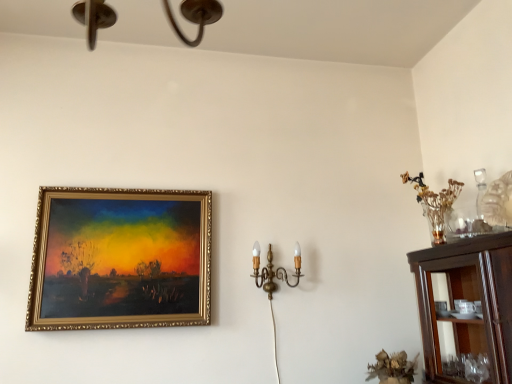
Where is `dark wood cabinet at right`? dark wood cabinet at right is located at coordinates (469, 300).

In order to click on gold ornate frame at upper left in this screenshot , I will do 120,259.

Image resolution: width=512 pixels, height=384 pixels. What are the coordinates of `dark wood cabinet at right` in the screenshot? It's located at (469, 300).

Would you say gold ornate frame at upper left is outside gold brass wall sconce at center right?

Yes, gold ornate frame at upper left is located beyond the bounds of gold brass wall sconce at center right.

Could you tell me if gold ornate frame at upper left is turned towards gold brass wall sconce at center right?

No, gold ornate frame at upper left is not oriented towards gold brass wall sconce at center right.

Considering the relative sizes of gold ornate frame at upper left and gold brass wall sconce at center right in the image provided, is gold ornate frame at upper left wider than gold brass wall sconce at center right?

Incorrect, the width of gold ornate frame at upper left does not surpass that of gold brass wall sconce at center right.

From a real-world perspective, does dark wood cabinet at right sit lower than gold brass wall sconce at center right?

Indeed, from a real-world perspective, dark wood cabinet at right is positioned beneath gold brass wall sconce at center right.

Is dark wood cabinet at right bigger or smaller than gold brass wall sconce at center right?

Considering their sizes, dark wood cabinet at right takes up more space than gold brass wall sconce at center right.

Is dark wood cabinet at right wider than gold brass wall sconce at center right?

Yes.

Is dark wood cabinet at right to the left of gold brass wall sconce at center right from the viewer's perspective?

In fact, dark wood cabinet at right is to the right of gold brass wall sconce at center right.

Locate an element on the screen. This screenshot has height=384, width=512. cabinetry in front of the gold brass wall sconce at center right is located at coordinates (469, 300).

Can you tell me how much gold brass wall sconce at center right and dark wood cabinet at right differ in facing direction?

89.1 degrees separate the facing orientations of gold brass wall sconce at center right and dark wood cabinet at right.

From the picture: From the image's perspective, which is below, gold brass wall sconce at center right or dark wood cabinet at right?

From the image's view, dark wood cabinet at right is below.

Looking at their sizes, would you say gold brass wall sconce at center right is wider or thinner than dark wood cabinet at right?

gold brass wall sconce at center right is thinner than dark wood cabinet at right.

Can we say dark wood cabinet at right lies outside gold ornate frame at upper left?

Yes, dark wood cabinet at right is outside of gold ornate frame at upper left.

Which is more to the right, dark wood cabinet at right or gold ornate frame at upper left?

From the viewer's perspective, dark wood cabinet at right appears more on the right side.

Does point (433, 376) come closer to viewer compared to point (45, 291)?

Yes, point (433, 376) is closer to viewer.

Does gold ornate frame at upper left have a greater height compared to dark wood cabinet at right?

Correct, gold ornate frame at upper left is much taller as dark wood cabinet at right.

Could dark wood cabinet at right be considered to be inside gold ornate frame at upper left?

No, gold ornate frame at upper left does not contain dark wood cabinet at right.

Is gold ornate frame at upper left not close to dark wood cabinet at right?

Yes, gold ornate frame at upper left is far from dark wood cabinet at right.

This screenshot has height=384, width=512. I want to click on picture frame above the gold brass wall sconce at center right (from a real-world perspective), so click(x=120, y=259).

Can you tell me how much gold brass wall sconce at center right and gold ornate frame at upper left differ in facing direction?

The angular difference between gold brass wall sconce at center right and gold ornate frame at upper left is 0.436 degrees.

From the image's perspective, which is above, gold brass wall sconce at center right or gold ornate frame at upper left?

gold ornate frame at upper left appears higher in the image.

From a real-world perspective, is gold brass wall sconce at center right on gold ornate frame at upper left?

No.

The height and width of the screenshot is (384, 512). I want to click on picture frame positioned vertically above the gold brass wall sconce at center right (from a real-world perspective), so click(x=120, y=259).

Locate an element on the screen. cabinetry below the gold brass wall sconce at center right (from a real-world perspective) is located at coordinates (469, 300).

When comparing their distances from dark wood cabinet at right, does gold brass wall sconce at center right or gold ornate frame at upper left seem further?

Based on the image, gold ornate frame at upper left appears to be further to dark wood cabinet at right.

From the image, which object appears to be farther from gold ornate frame at upper left, gold brass wall sconce at center right or dark wood cabinet at right?

The object further to gold ornate frame at upper left is dark wood cabinet at right.

From the image, which object appears to be nearer to gold brass wall sconce at center right, dark wood cabinet at right or gold ornate frame at upper left?

gold ornate frame at upper left is positioned closer to the anchor gold brass wall sconce at center right.

Considering their positions, is dark wood cabinet at right positioned further to gold ornate frame at upper left than gold brass wall sconce at center right?

dark wood cabinet at right is positioned further to the anchor gold ornate frame at upper left.

Estimate the real-world distances between objects in this image. Which object is closer to dark wood cabinet at right, gold ornate frame at upper left or gold brass wall sconce at center right?

gold brass wall sconce at center right lies closer to dark wood cabinet at right than the other object.

Estimate the real-world distances between objects in this image. Which object is further from gold brass wall sconce at center right, gold ornate frame at upper left or dark wood cabinet at right?

dark wood cabinet at right lies further to gold brass wall sconce at center right than the other object.

At what (x,y) coordinates should I click in order to perform the action: click on candle holder between gold ornate frame at upper left and dark wood cabinet at right from left to right. Please return your answer as a coordinate pair (x, y). Image resolution: width=512 pixels, height=384 pixels. Looking at the image, I should click on (274, 271).